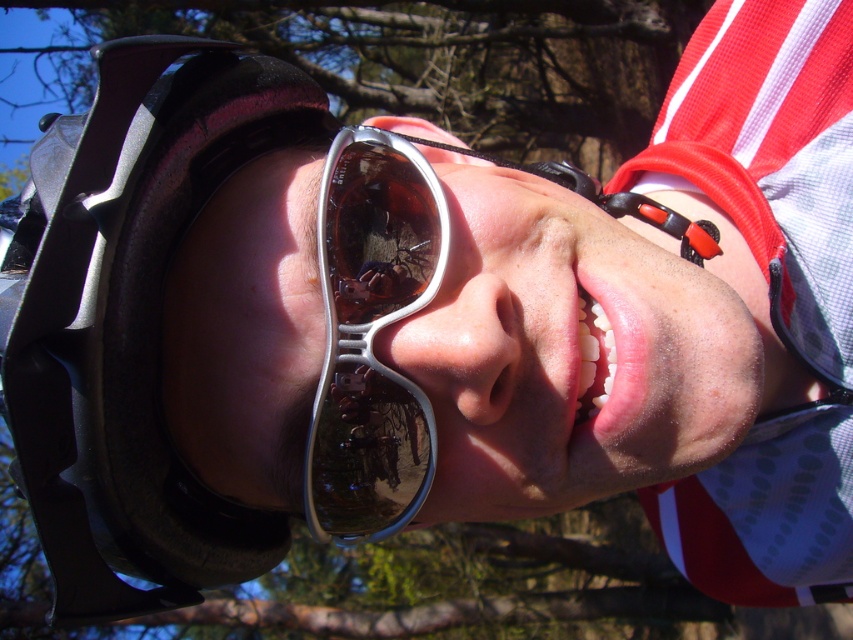
Question: Does black matte helmet at left appear under silver metallic sunglasses at center?

Choices:
 (A) no
 (B) yes

Answer: (A)

Question: Which point is farther to the camera?

Choices:
 (A) (183, 45)
 (B) (426, 456)

Answer: (B)

Question: Which of the following is the farthest from the observer?

Choices:
 (A) black matte helmet at left
 (B) silver metallic sunglasses at center

Answer: (B)

Question: Is black matte helmet at left to the right of silver metallic sunglasses at center from the viewer's perspective?

Choices:
 (A) no
 (B) yes

Answer: (A)

Question: Can you confirm if black matte helmet at left is thinner than silver metallic sunglasses at center?

Choices:
 (A) no
 (B) yes

Answer: (A)

Question: Which object appears farthest from the camera in this image?

Choices:
 (A) black matte helmet at left
 (B) silver metallic sunglasses at center

Answer: (B)